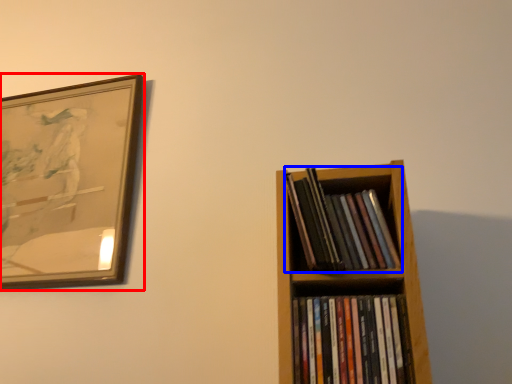
Question: Which object appears farthest to the camera in this image, picture frame (highlighted by a red box) or book (highlighted by a blue box)?

Choices:
 (A) picture frame
 (B) book

Answer: (A)